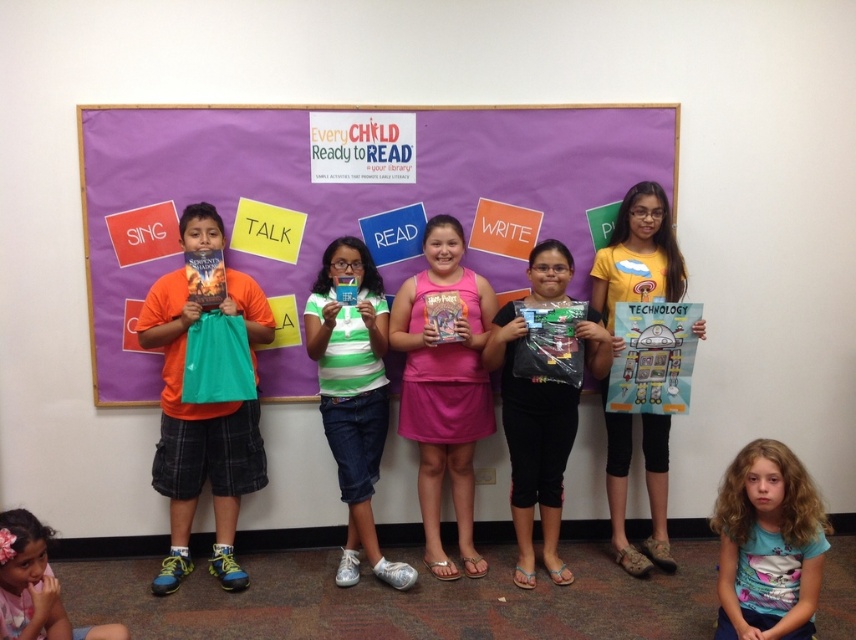
Question: Which of these objects is positioned farthest from the purple fabric banner at upper center?

Choices:
 (A) black matte bag at center
 (B) orange fabric shirt at left
 (C) green striped shirt at center

Answer: (A)

Question: In this image, where is yellow t-shirt at center located relative to pink fabric at lower left?

Choices:
 (A) above
 (B) below

Answer: (A)

Question: Is pink fabric dress at center smaller than black matte bag at center?

Choices:
 (A) yes
 (B) no

Answer: (A)

Question: Which point is farther to the camera?

Choices:
 (A) pink fabric dress at center
 (B) pink fabric at lower left
 (C) yellow t-shirt at center
 (D) black matte bag at center

Answer: (C)

Question: Which point is farther to the camera?

Choices:
 (A) green striped shirt at center
 (B) pink fabric at lower left

Answer: (A)

Question: Does purple fabric banner at upper center appear under black matte bag at center?

Choices:
 (A) yes
 (B) no

Answer: (B)